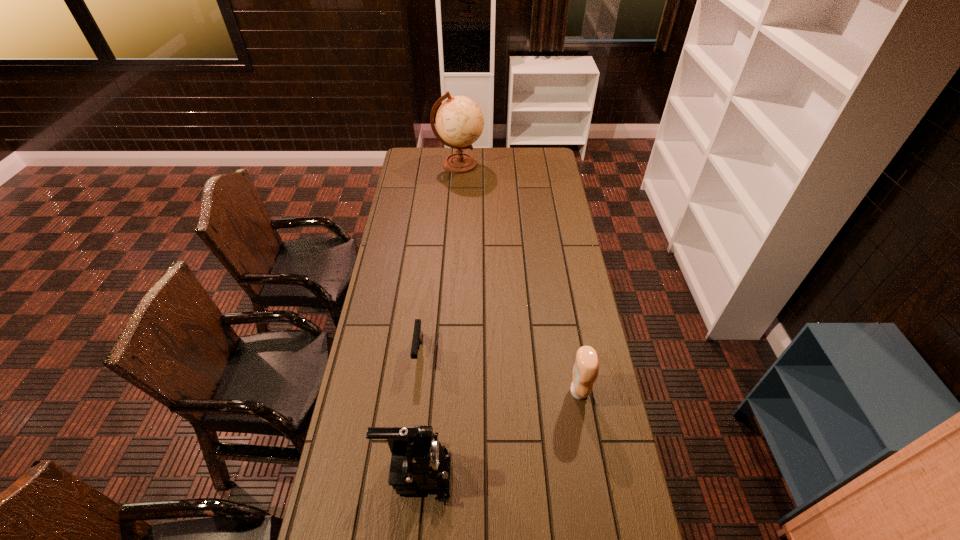
Find the location of a particular element. free space between the farthest object and the pistol is located at coordinates (439, 258).

I want to click on object that is the second closest to the second shortest object, so 417,339.

Identify which object is located as the third nearest to the condiment. Please provide its 2D coordinates. Your answer should be formatted as a tuple, i.e. [(x, y)], where the tuple contains the x and y coordinates of a point satisfying the conditions above.

[(459, 120)]

Image resolution: width=960 pixels, height=540 pixels. I want to click on free space that satisfies the following two spatial constraints: 1. on the surface of the globe; 2. on the front-facing side of the shortest object, so click(x=447, y=353).